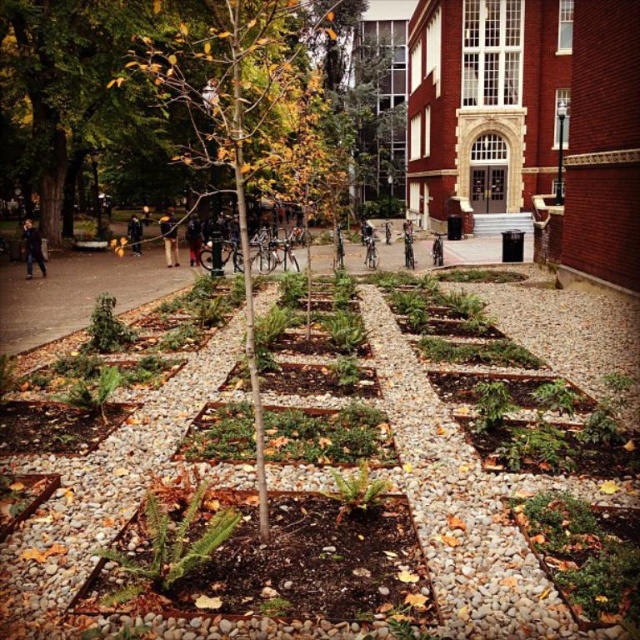
Question: Does green leafy plant at center have a smaller size compared to dark gray jacket at center?

Choices:
 (A) yes
 (B) no

Answer: (A)

Question: Among these objects, which one is farthest from the camera?

Choices:
 (A) dark blue jacket at left
 (B) dark gray jacket at center

Answer: (B)

Question: Which is nearer to the black leather jacket at center?

Choices:
 (A) green leafy plant at center
 (B) green leafy tree at center
 (C) dark gray jacket at center
 (D) yellow jacket at center

Answer: (D)

Question: Can you confirm if dark gray jacket at center is positioned to the right of black leather jacket at center?

Choices:
 (A) yes
 (B) no

Answer: (A)

Question: In this image, where is dark blue jacket at left located relative to black leather jacket at center?

Choices:
 (A) below
 (B) above

Answer: (A)

Question: Which object is closer to the camera taking this photo?

Choices:
 (A) yellow jacket at center
 (B) green leafy tree at center

Answer: (B)